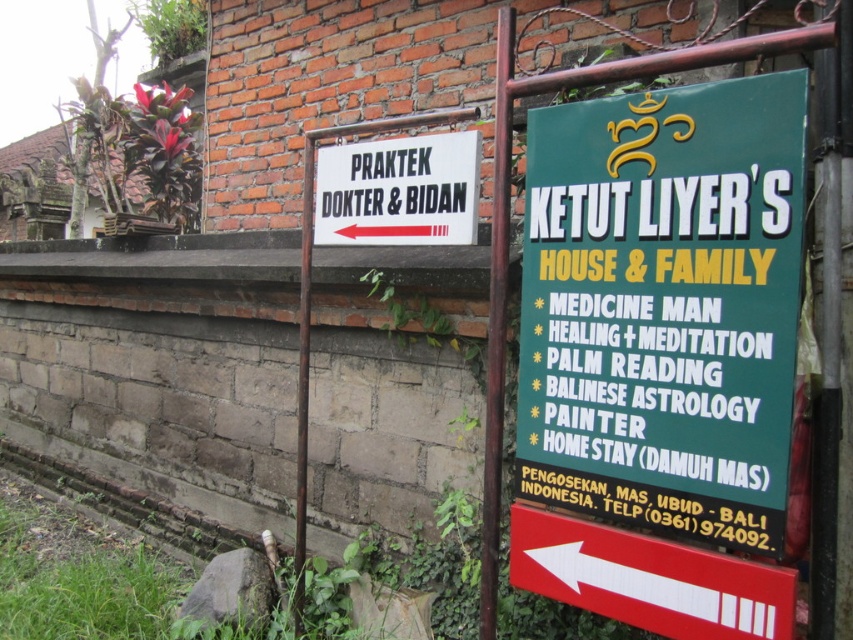
Question: Which object is farther from the camera taking this photo?

Choices:
 (A) white matte sign at left
 (B) white paper sign at left
 (C) green matte signboard at upper right
 (D) red arrow sign at left

Answer: (A)

Question: Where is green matte signboard at upper right located in relation to white matte sign at left in the image?

Choices:
 (A) right
 (B) left

Answer: (A)

Question: Is red arrow sign at left in front of white paper sign at left?

Choices:
 (A) yes
 (B) no

Answer: (A)

Question: Based on their relative distances, which object is nearer to the red arrow sign at left?

Choices:
 (A) white matte sign at left
 (B) green matte signboard at upper right
 (C) white paper sign at left

Answer: (B)

Question: Is red arrow sign at left behind white paper sign at left?

Choices:
 (A) yes
 (B) no

Answer: (B)

Question: Which object is positioned closest to the red arrow sign at left?

Choices:
 (A) green matte signboard at upper right
 (B) white matte sign at left

Answer: (A)